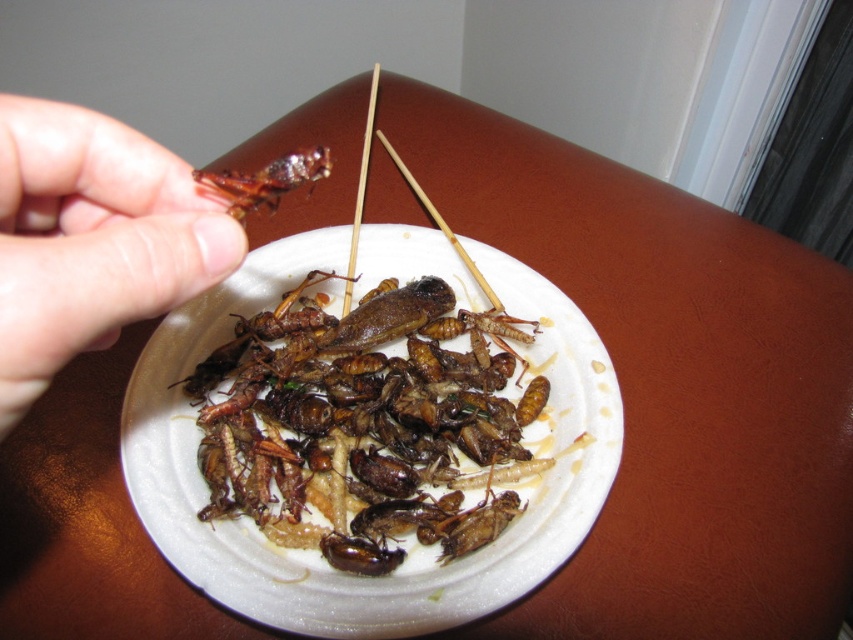
You are a food critic who needs to describe the position of the brown crispy insects at center in the image. What are their coordinates?

The brown crispy insects at center are located at coordinates (x=366, y=422).